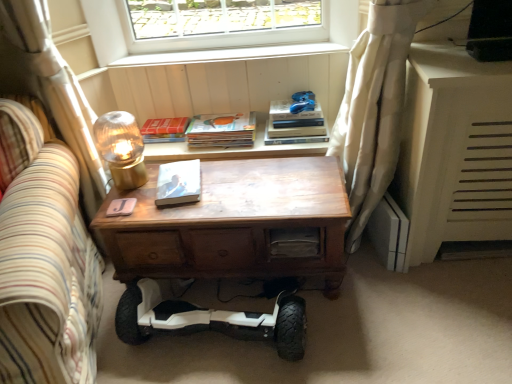
Question: Is wooden desk at center to the right of blue fabric toy at upper center from the viewer's perspective?

Choices:
 (A) no
 (B) yes

Answer: (A)

Question: Is wooden desk at center turned away from blue fabric toy at upper center?

Choices:
 (A) yes
 (B) no

Answer: (B)

Question: Is wooden desk at center to the left of blue fabric toy at upper center from the viewer's perspective?

Choices:
 (A) yes
 (B) no

Answer: (A)

Question: Could you tell me if wooden desk at center is turned towards blue fabric toy at upper center?

Choices:
 (A) no
 (B) yes

Answer: (A)

Question: Can you confirm if wooden desk at center is wider than blue fabric toy at upper center?

Choices:
 (A) no
 (B) yes

Answer: (B)

Question: Is wooden desk at center far away from blue fabric toy at upper center?

Choices:
 (A) no
 (B) yes

Answer: (A)

Question: Is blue fabric toy at upper center completely or partially inside hardcover books at upper right?

Choices:
 (A) no
 (B) yes

Answer: (A)

Question: Can you confirm if hardcover books at upper right is taller than blue fabric toy at upper center?

Choices:
 (A) no
 (B) yes

Answer: (B)

Question: Is hardcover books at upper right smaller than blue fabric toy at upper center?

Choices:
 (A) yes
 (B) no

Answer: (B)

Question: Is hardcover books at upper right with blue fabric toy at upper center?

Choices:
 (A) yes
 (B) no

Answer: (A)

Question: Can you confirm if hardcover books at upper right is thinner than blue fabric toy at upper center?

Choices:
 (A) no
 (B) yes

Answer: (A)

Question: From a real-world perspective, is hardcover books at upper right located beneath blue fabric toy at upper center?

Choices:
 (A) yes
 (B) no

Answer: (A)

Question: Is matte white book at center, the 3th paperback book in the top-to-bottom sequence, a part of hardcover book at upper center, which ranks as the 3th paperback book in bottom-to-top order?

Choices:
 (A) yes
 (B) no

Answer: (B)